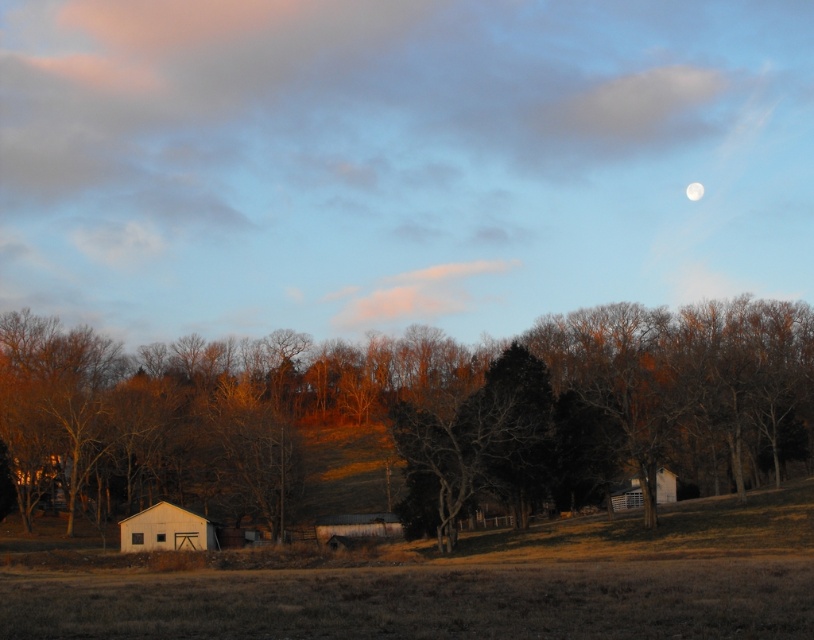
You are a farmer who needs to move a large tractor from the white matte barn at lower left to the white wooden barn at lower right. Given that the tractor requires a minimum of 100 feet of space to maneuver safely, can you safely navigate the tractor between these two barns?

Result: The distance between the white matte barn at lower left and the white wooden barn at lower right is 107.22 feet, which exceeds the tractor minimum requirement of 100 feet. Therefore, the tractor can be safely navigated between these two barns.

You are standing in the rural landscape and want to walk towards the point that is closer to you. Which point should you head towards, point (615, 497) or point (694, 198)?

Point (615, 497) is in front of point (694, 198), so you should head towards point (615, 497) as it is closer to you.

You are standing at the center of the field in the image. You want to walk to the white matte barn at lower left. Which direction should you head?

To reach the white matte barn at lower left, you should head towards the lower left direction since it is located at point (167, 529).